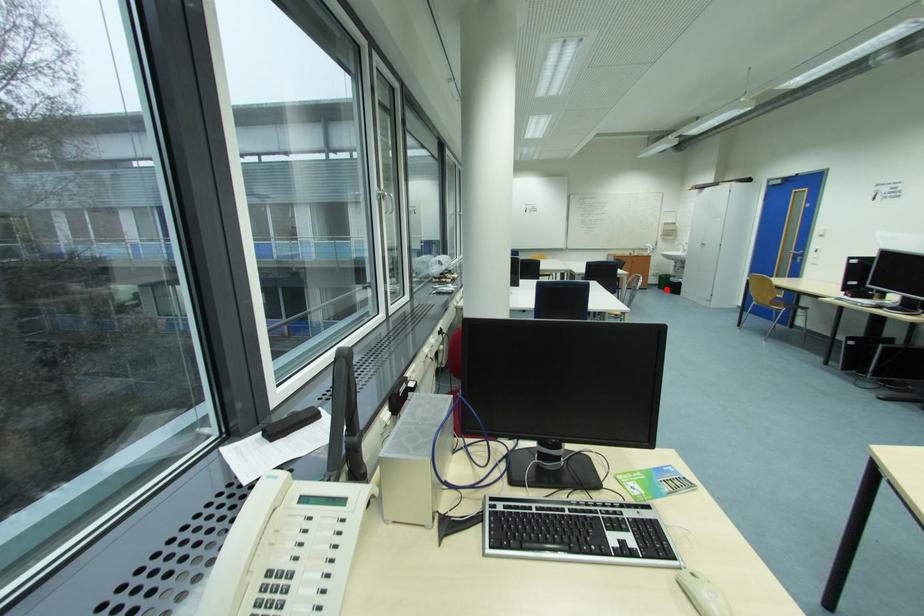
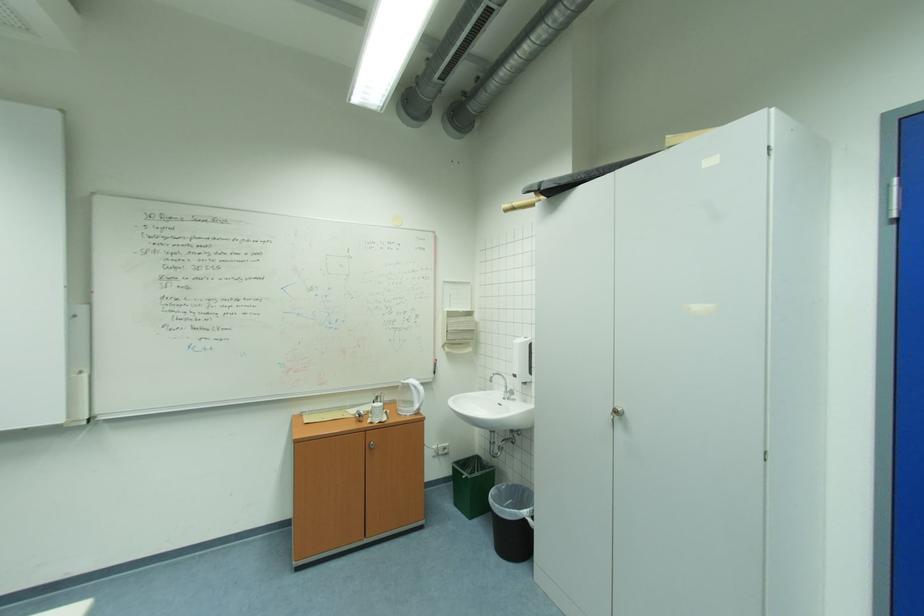
Where in the second image is the point corresponding to the highlighted location from the first image?

(464, 505)